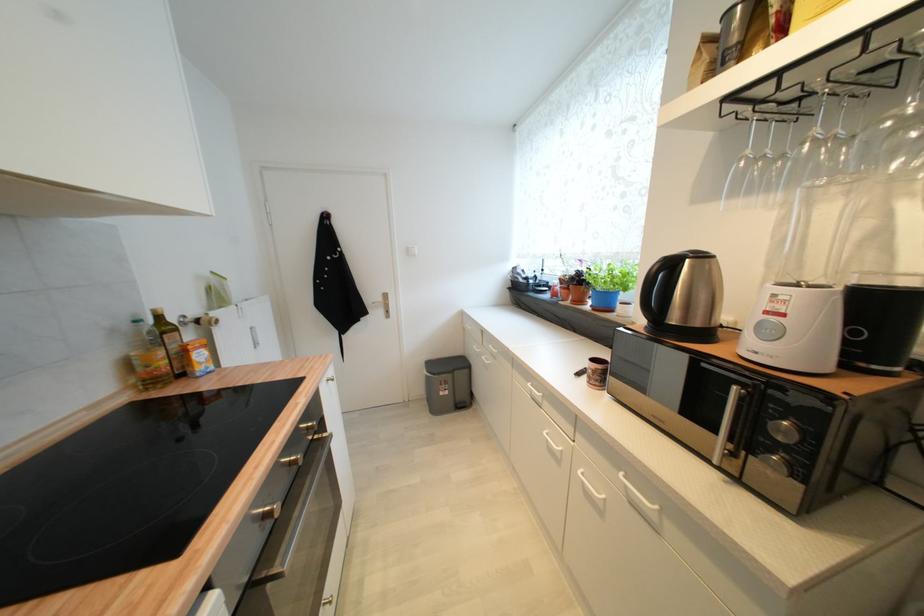
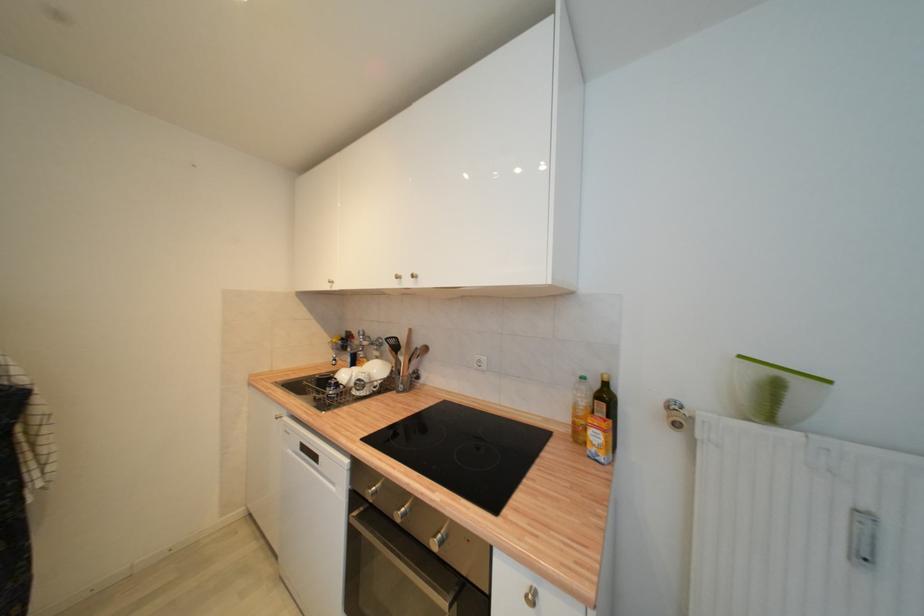
Locate, in the second image, the point that corresponds to (x=141, y=323) in the first image.

(586, 379)